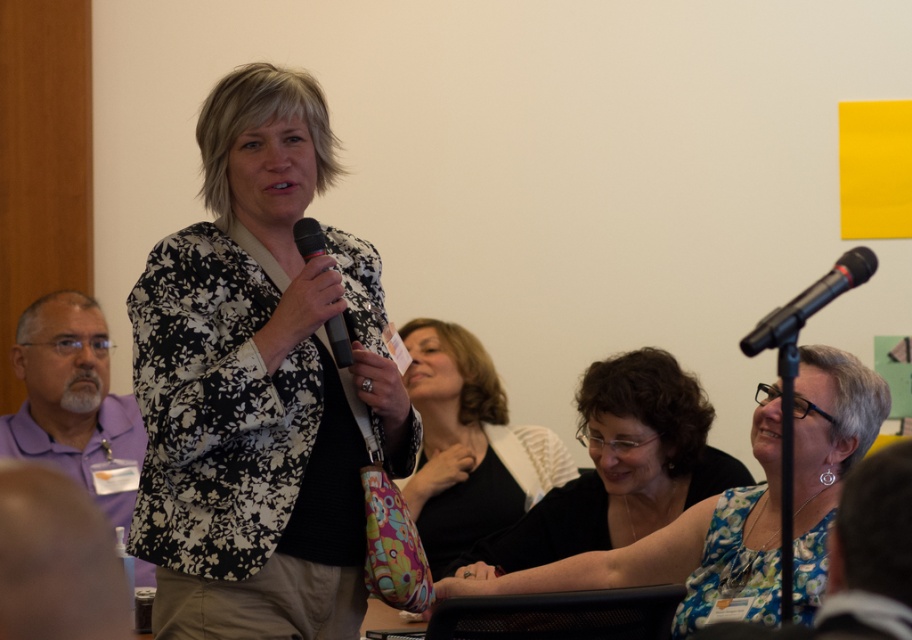
Does floral-patterned blazer at center have a lesser width compared to floral fabric blouse at center?

Yes.

Is the position of floral-patterned blazer at center more distant than that of floral fabric blouse at center?

No, it is not.

The width and height of the screenshot is (912, 640). In order to click on floral-patterned blazer at center in this screenshot , I will do `click(260, 385)`.

Can you confirm if purple fabric shirt at left is positioned below black metallic microphone at upper right?

Yes, purple fabric shirt at left is below black metallic microphone at upper right.

Is purple fabric shirt at left shorter than black metallic microphone at upper right?

→ No.

What do you see at coordinates (71, 400) in the screenshot? The image size is (912, 640). I see `purple fabric shirt at left` at bounding box center [71, 400].

Find the location of a particular element. purple fabric shirt at left is located at coordinates (71, 400).

Can you confirm if floral-patterned blazer at center is taller than black matte microphone at center?

Correct, floral-patterned blazer at center is much taller as black matte microphone at center.

Is point (338, 285) closer to camera compared to point (329, 317)?

Yes, it is.

Locate an element on the screen. This screenshot has height=640, width=912. floral-patterned blazer at center is located at coordinates (260, 385).